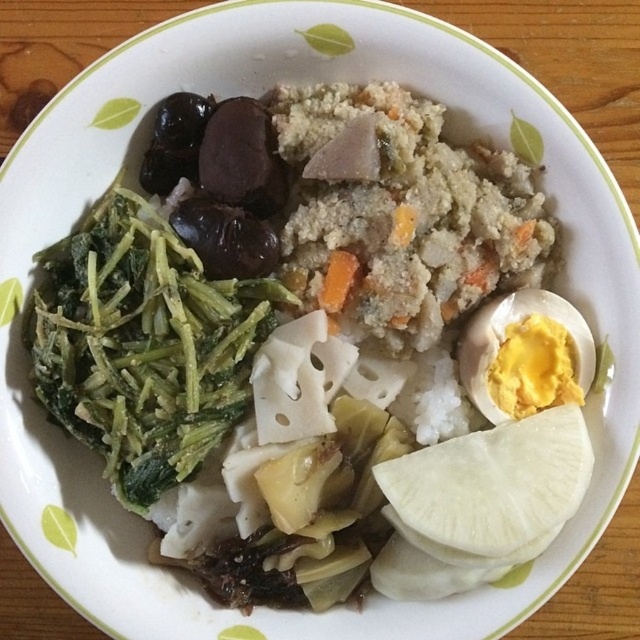
What are the coordinates of `green leafy vegetable at upper left` in the screenshot? It's located at (144, 344).

Does point (33, 362) come farther from viewer compared to point (576, 339)?

No.

The height and width of the screenshot is (640, 640). What are the coordinates of `green leafy vegetable at upper left` in the screenshot? It's located at (144, 344).